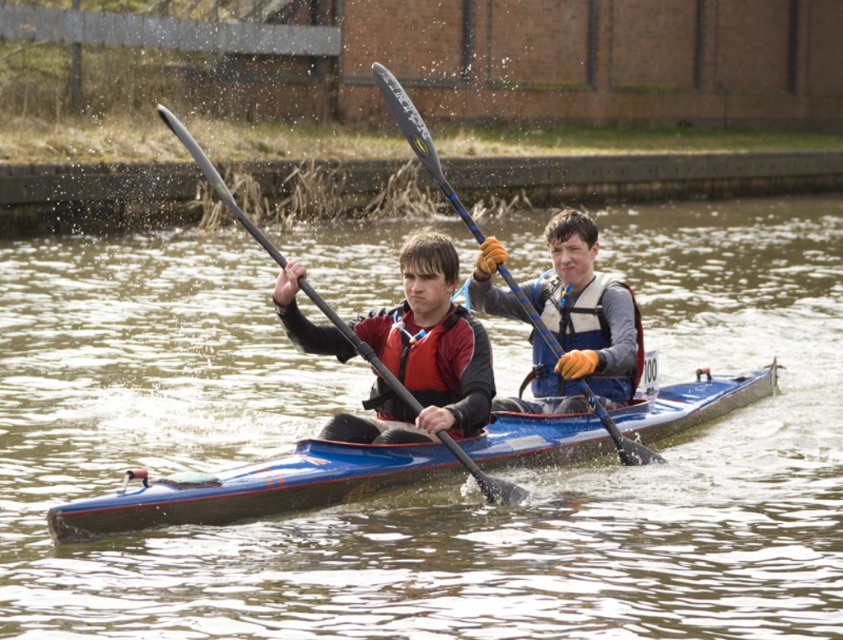
Question: Is gray fabric life jacket at center positioned before blue glossy paddle at center?

Choices:
 (A) no
 (B) yes

Answer: (A)

Question: Which point is closer to the camera?

Choices:
 (A) (593, 330)
 (B) (575, 355)

Answer: (B)

Question: Which point appears farthest from the camera in this image?

Choices:
 (A) (455, 384)
 (B) (106, 593)

Answer: (A)

Question: Which of the following is the closest to the observer?

Choices:
 (A) (256, 422)
 (B) (262, 480)

Answer: (B)

Question: Is brown murky water at center to the right of blue glossy kayak at center from the viewer's perspective?

Choices:
 (A) yes
 (B) no

Answer: (B)

Question: Can you confirm if matte blue kayak at center is bigger than matte black paddle at left?

Choices:
 (A) no
 (B) yes

Answer: (A)